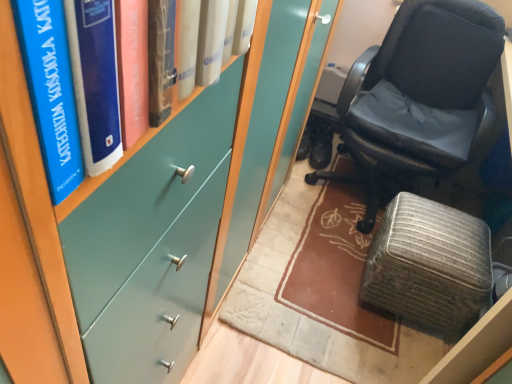
The image size is (512, 384). I want to click on blank space situated above textured gray ottoman at lower right (from a real-world perspective), so click(x=445, y=236).